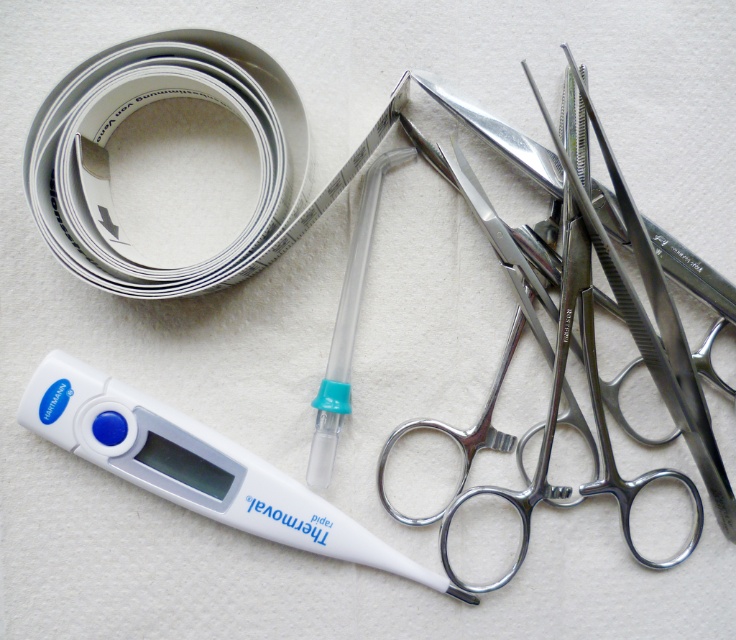
You are a nurse preparing to sterilize medical equipment. You need to locate the white paper tape at upper left. Where exactly is it positioned on the table?

The white paper tape at upper left is located at the coordinate point of (132, 113) on the table.

You are a medical professional who needs to reach the white paper tape at upper left from your current position. Considering your arm length is 0.7 meters, can you comfortably reach it without moving your body?

The white paper tape at upper left is 1.19 meters away from the camera. Since your arm length is 0.7 meters, you cannot comfortably reach it without moving your body.

You are a nurse preparing to organize medical supplies on a tray. You have the white paper tape at upper left and the white plastic thermometer at lower left. Which object should you place first if you want to arrange items from smallest to largest?

The white paper tape at upper left has a smaller size compared to the white plastic thermometer at lower left, so you should place the white paper tape at upper left first when arranging items from smallest to largest.